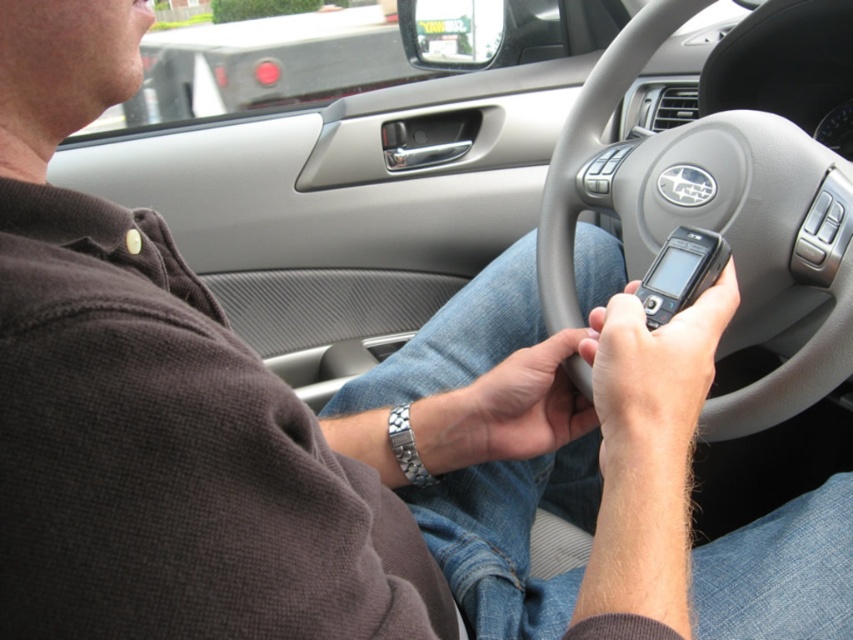
Question: Does gray matte steering wheel at center have a lesser width compared to black plastic phone at center?

Choices:
 (A) yes
 (B) no

Answer: (B)

Question: Which point is farther from the camera taking this photo?

Choices:
 (A) (665, 339)
 (B) (692, 269)
 (C) (570, 148)

Answer: (C)

Question: Can you confirm if gray matte steering wheel at center is positioned below black plastic phone at center?

Choices:
 (A) no
 (B) yes

Answer: (A)

Question: Which of the following is the farthest from the observer?

Choices:
 (A) (780, 394)
 (B) (668, 312)
 (C) (630, 420)

Answer: (A)

Question: Is gray matte steering wheel at center closer to camera compared to black plastic phone at center?

Choices:
 (A) yes
 (B) no

Answer: (B)

Question: Which point is closer to the camera taking this photo?

Choices:
 (A) pyautogui.click(x=648, y=445)
 (B) pyautogui.click(x=666, y=269)

Answer: (A)